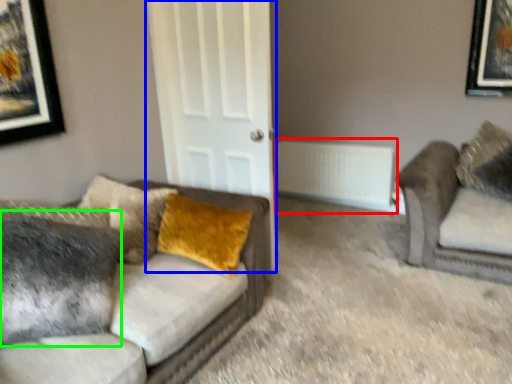
Question: Considering the real-world distances, which object is closest to radiator (highlighted by a red box)? door (highlighted by a blue box) or pillow (highlighted by a green box).

Choices:
 (A) door
 (B) pillow

Answer: (A)